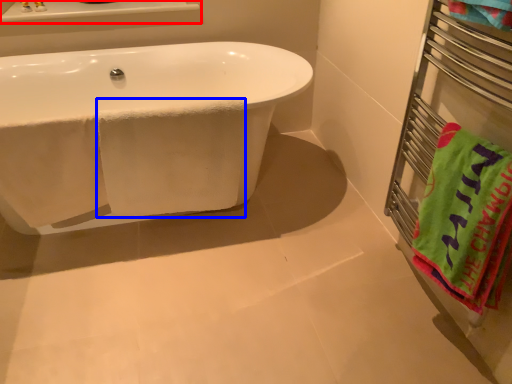
Question: Which object is closer to the camera taking this photo, window sill (highlighted by a red box) or bath towel (highlighted by a blue box)?

Choices:
 (A) window sill
 (B) bath towel

Answer: (B)